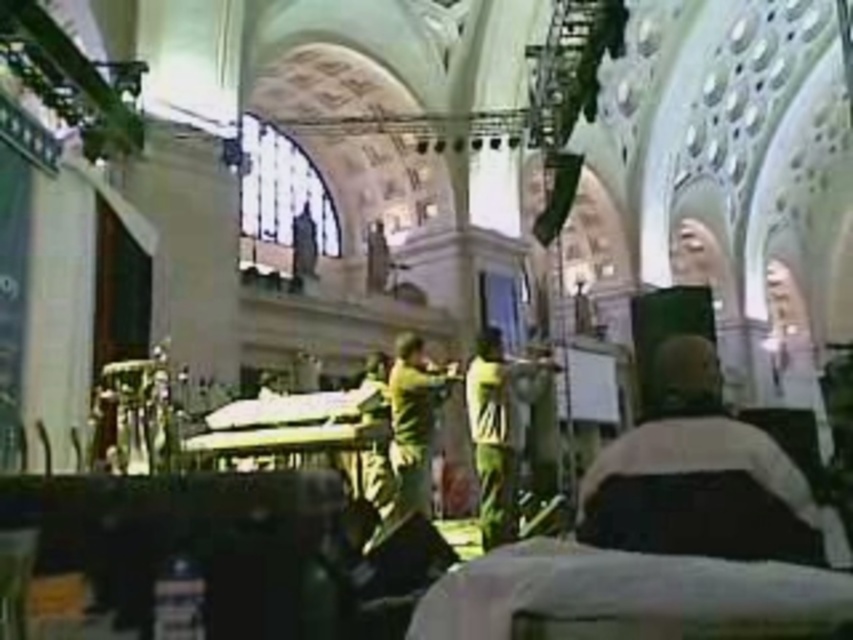
You are standing in the grand building and see the point at coordinates (x=697, y=474). Which object is this point located on?

The point at coordinates (x=697, y=474) is located on the dark gray fabric jacket at center.

You are a medical professional observing the scene. You notice the dark gray fabric jacket at center and the green fabric shirt at center. Which clothing item is covering the other?

The dark gray fabric jacket at center is positioned over the green fabric shirt at center, so the dark gray jacket is covering the green shirt.

You are a visitor in this historical building and notice two people at the center wearing the dark gray fabric jacket at center and the green matte shirt at center. Which clothing item is bigger in size?

The dark gray fabric jacket at center is larger in size than the green matte shirt at center.